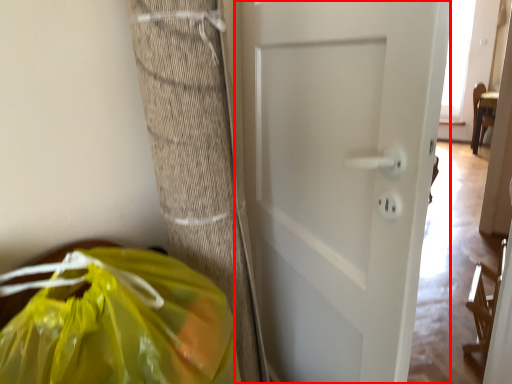
Question: From the image's perspective, considering the relative positions of door (annotated by the red box) and plastic bag in the image provided, where is door (annotated by the red box) located with respect to the staircase?

Choices:
 (A) below
 (B) above

Answer: (B)